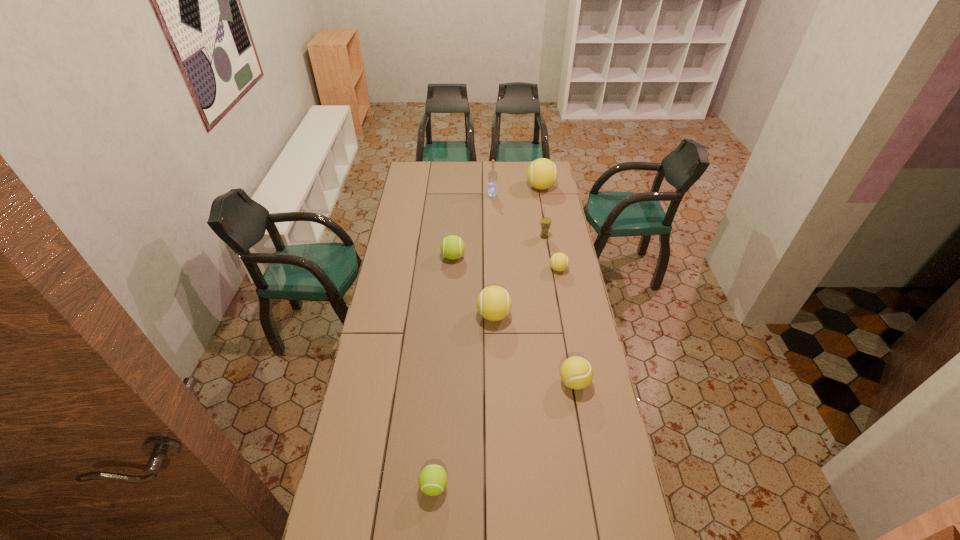
You are a GUI agent. You are given a task and a screenshot of the screen. Output one action in this format:
    pyautogui.click(x=<x>, y=<y>)
    Task: Click on the vacant space located on the right of the nearest tennis ball
    
    Given the screenshot: What is the action you would take?
    pyautogui.click(x=521, y=486)

This screenshot has height=540, width=960. I want to click on free space located on the left of the third nearest yellow tennis ball, so click(514, 269).

Where is `object located at the far edge`? The width and height of the screenshot is (960, 540). object located at the far edge is located at coordinates (542, 173).

The width and height of the screenshot is (960, 540). Identify the location of straw for drinking at the right edge. (545, 222).

The image size is (960, 540). I want to click on object present at the far right corner, so click(x=542, y=173).

In the image, there is a desktop. What are the coordinates of `vacant space at the far edge` in the screenshot? It's located at (504, 180).

I want to click on free space at the left edge of the desktop, so (407, 271).

In the image, there is a desktop. Identify the location of free space at the right edge. (575, 406).

The width and height of the screenshot is (960, 540). I want to click on unoccupied area between the farther green tennis ball and the farthest tennis ball, so click(497, 222).

In order to click on free space between the blue vodka and the second tallest tennis ball in this screenshot , I will do `click(493, 255)`.